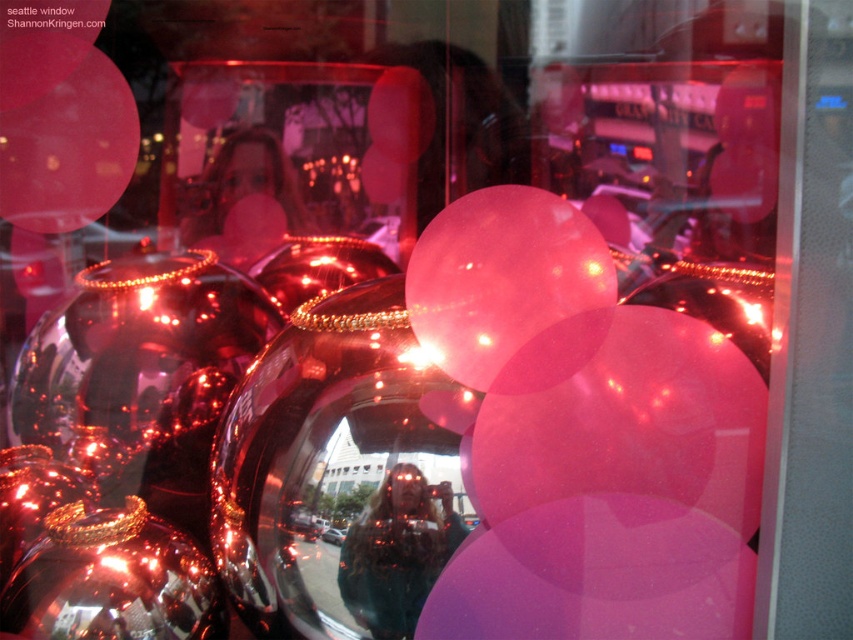
Question: Can you confirm if pink matte balloon at upper left is smaller than pink glossy balloon at center?

Choices:
 (A) no
 (B) yes

Answer: (A)

Question: Which point appears farthest from the camera in this image?

Choices:
 (A) (538, 324)
 (B) (389, 148)
 (C) (39, 164)

Answer: (B)

Question: Does pink translucent balloon at center appear under pink glossy balloon at center?

Choices:
 (A) yes
 (B) no

Answer: (A)

Question: Which point is closer to the camera?

Choices:
 (A) (427, 109)
 (B) (90, 92)

Answer: (B)

Question: Which of these objects is positioned farthest from the pink glossy balloon at center?

Choices:
 (A) pink translucent balloon at center
 (B) pink matte balloon at upper left

Answer: (A)

Question: Is pink translucent balloon at center to the right of pink glossy balloon at center from the viewer's perspective?

Choices:
 (A) yes
 (B) no

Answer: (A)